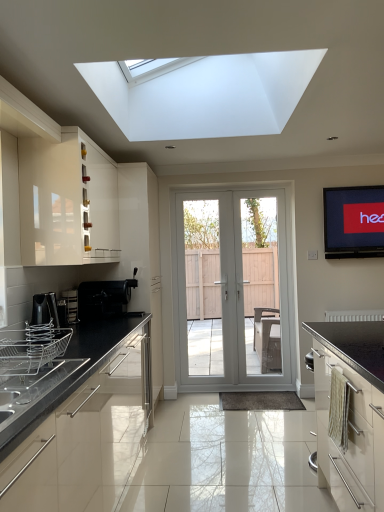
Question: In the image, is metallic silver dish rack at left, which is the 2th appliance in front-to-back order, on the left side or the right side of black matte coffee machine at left, placed as the 4th appliance when sorted from front to back?

Choices:
 (A) right
 (B) left

Answer: (B)

Question: Relative to black matte coffee machine at left, placed as the 4th appliance when sorted from front to back, is metallic silver dish rack at left, the 3th appliance viewed from the back, in front or behind?

Choices:
 (A) front
 (B) behind

Answer: (A)

Question: Considering the real-world distances, which object is farthest from the satin silver dish rack at left, which is the fourth appliance from back to front?

Choices:
 (A) metallic silver dish rack at left, the 3th appliance viewed from the back
 (B) white glossy door at center
 (C) matte black oven at lower right, which is the first cabinetry in right-to-left order
 (D) glossy white cabinet at upper left, the 2th cabinetry from the front
 (E) matte black tv at upper right

Answer: (E)

Question: Considering the real-world distances, which object is farthest from the white glossy door at center, acting as the second screen door starting from the left?

Choices:
 (A) satin silver toaster at left, the 3th appliance from the front
 (B) white glossy screen door at center, the 1th screen door positioned from the left
 (C) white glossy door at center
 (D) metallic silver dish rack at left, the 3th appliance viewed from the back
 (E) matte black tv at upper right

Answer: (D)